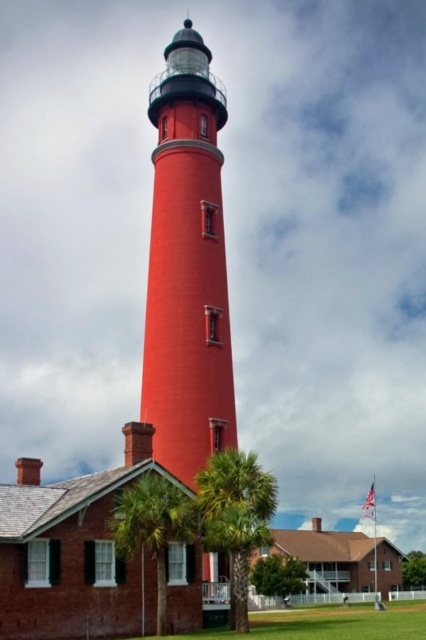
Question: Can you confirm if matte red lighthouse at center is thinner than green leafy palm tree at center?

Choices:
 (A) no
 (B) yes

Answer: (A)

Question: Which of the following is the farthest from the observer?

Choices:
 (A) (132, 518)
 (B) (149, 305)

Answer: (B)

Question: Which object appears closest to the camera in this image?

Choices:
 (A) green leafy palm tree at lower center
 (B) matte red lighthouse at center
 (C) green leafy palm tree at center

Answer: (C)

Question: Which object appears closest to the camera in this image?

Choices:
 (A) green leafy palm tree at center
 (B) green leafy palm tree at lower center
 (C) matte red lighthouse at center

Answer: (A)

Question: Does green leafy palm tree at lower center have a smaller size compared to green leafy palm tree at center?

Choices:
 (A) no
 (B) yes

Answer: (A)

Question: Can you confirm if green leafy palm tree at lower center is smaller than green leafy palm tree at center?

Choices:
 (A) yes
 (B) no

Answer: (B)